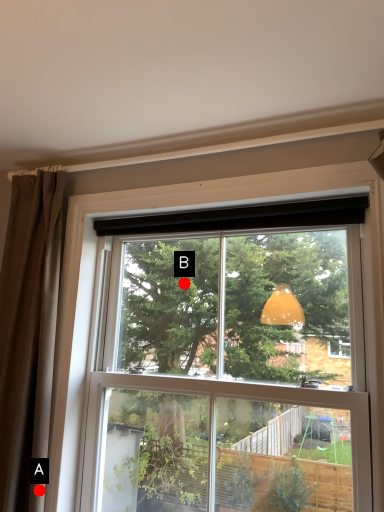
Question: Two points are circled on the image, labeled by A and B beside each circle. Which point is closer to the camera?

Choices:
 (A) A is closer
 (B) B is closer

Answer: (A)